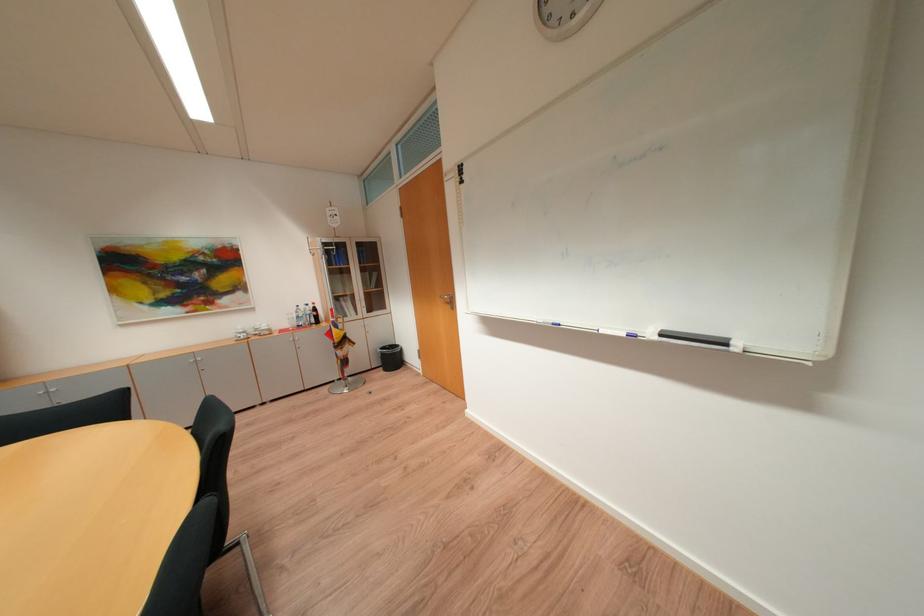
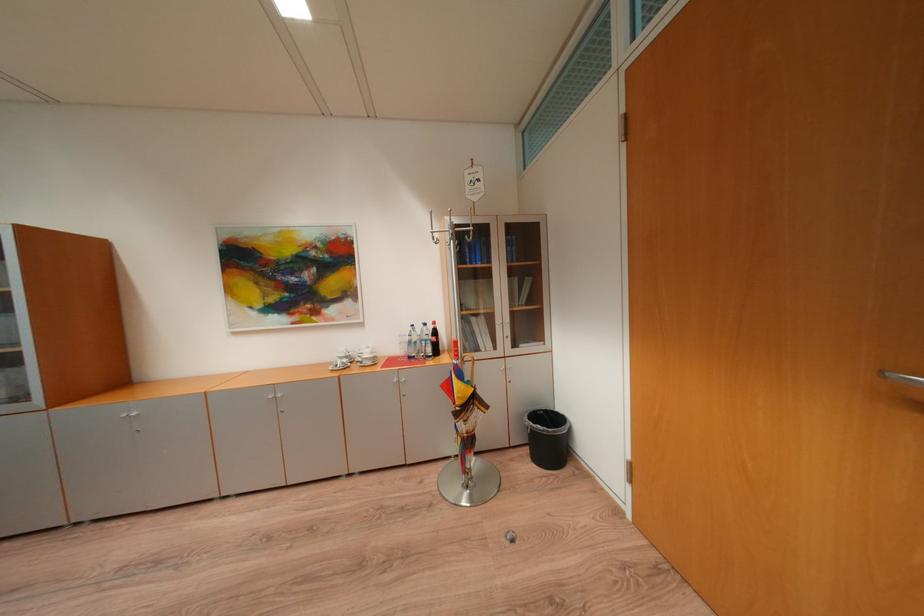
Locate, in the second image, the point that corresponds to the point at 253,334 in the first image.

(355, 359)